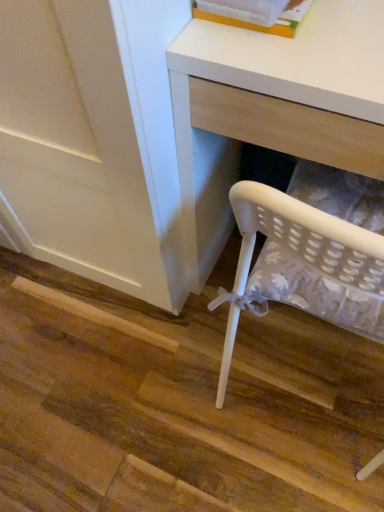
Question: Considering their positions, is white plastic book at upper center located in front of or behind white matte desk at lower right?

Choices:
 (A) front
 (B) behind

Answer: (B)

Question: From a real-world perspective, is white plastic book at upper center physically located above or below white matte desk at lower right?

Choices:
 (A) below
 (B) above

Answer: (B)

Question: In terms of width, does white plastic book at upper center look wider or thinner when compared to white matte desk at lower right?

Choices:
 (A) wide
 (B) thin

Answer: (B)

Question: Considering the positions of point (254, 72) and point (296, 5), is point (254, 72) closer or farther from the camera than point (296, 5)?

Choices:
 (A) farther
 (B) closer

Answer: (B)

Question: From their relative heights in the image, would you say white matte desk at lower right is taller or shorter than white plastic book at upper center?

Choices:
 (A) tall
 (B) short

Answer: (A)

Question: Considering the relative positions of white matte desk at lower right and white plastic book at upper center in the image provided, is white matte desk at lower right to the left or to the right of white plastic book at upper center?

Choices:
 (A) right
 (B) left

Answer: (A)

Question: From a real-world perspective, relative to white plastic book at upper center, is white matte desk at lower right vertically above or below?

Choices:
 (A) above
 (B) below

Answer: (B)